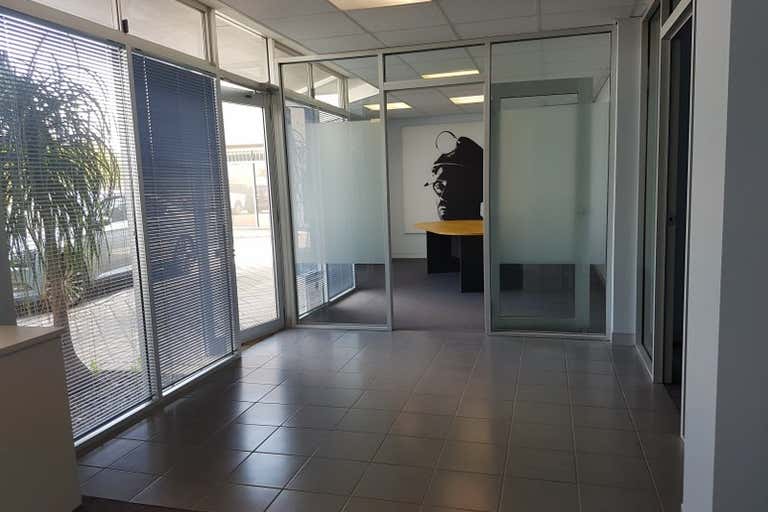
I want to click on frame of opened door, so click(x=587, y=184).